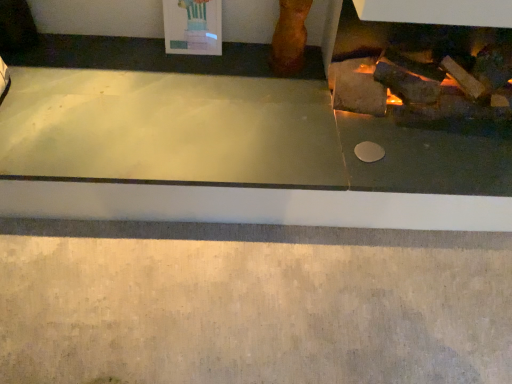
The width and height of the screenshot is (512, 384). Describe the element at coordinates (248, 144) in the screenshot. I see `matte stone fireplace at right` at that location.

What is the approximate width of matte stone fireplace at right?

matte stone fireplace at right is 33.99 inches in width.

Where is `matte stone fireplace at right`? This screenshot has height=384, width=512. matte stone fireplace at right is located at coordinates (248, 144).

This screenshot has width=512, height=384. Describe the element at coordinates (252, 304) in the screenshot. I see `smooth concrete at lower center` at that location.

Locate an element on the screen. The height and width of the screenshot is (384, 512). smooth concrete at lower center is located at coordinates (x=252, y=304).

Measure the distance between point (273, 245) and camera.

A distance of 1.52 meters exists between point (273, 245) and camera.

Locate an element on the screen. matte stone fireplace at right is located at coordinates (248, 144).

Based on the photo, can you confirm if matte stone fireplace at right is positioned to the left of smooth concrete at lower center?

Correct, you'll find matte stone fireplace at right to the left of smooth concrete at lower center.

Is matte stone fireplace at right in front of or behind smooth concrete at lower center in the image?

matte stone fireplace at right is positioned farther from the viewer than smooth concrete at lower center.

Is point (226, 151) positioned after point (231, 307)?

Yes, it is.

From the image's perspective, which is above, matte stone fireplace at right or smooth concrete at lower center?

From the image's view, matte stone fireplace at right is above.

Based on the photo, from a real-world perspective, between matte stone fireplace at right and smooth concrete at lower center, who is vertically lower?

In real-world perspective, smooth concrete at lower center is lower.

Does matte stone fireplace at right have a lesser width compared to smooth concrete at lower center?

Indeed, matte stone fireplace at right has a lesser width compared to smooth concrete at lower center.

Can you confirm if matte stone fireplace at right is shorter than smooth concrete at lower center?

Indeed, matte stone fireplace at right has a lesser height compared to smooth concrete at lower center.

Considering the relative sizes of matte stone fireplace at right and smooth concrete at lower center in the image provided, is matte stone fireplace at right smaller than smooth concrete at lower center?

Actually, matte stone fireplace at right might be larger than smooth concrete at lower center.

Do you think matte stone fireplace at right is within smooth concrete at lower center, or outside of it?

matte stone fireplace at right is outside smooth concrete at lower center.

Is matte stone fireplace at right placed right next to smooth concrete at lower center?

No, matte stone fireplace at right is not in contact with smooth concrete at lower center.

Is smooth concrete at lower center at the back of matte stone fireplace at right?

That's not correct — matte stone fireplace at right is not looking away from smooth concrete at lower center.

In the scene shown: What's the angular difference between matte stone fireplace at right and smooth concrete at lower center's facing directions?

matte stone fireplace at right and smooth concrete at lower center are facing 90.1 degrees away from each other.

Find the location of a particular element. The height and width of the screenshot is (384, 512). concrete in front of the matte stone fireplace at right is located at coordinates (252, 304).

Between smooth concrete at lower center and matte stone fireplace at right, which one appears on the left side from the viewer's perspective?

Positioned to the left is matte stone fireplace at right.

Considering the relative positions of smooth concrete at lower center and matte stone fireplace at right in the image provided, is smooth concrete at lower center behind matte stone fireplace at right?

No, the depth of smooth concrete at lower center is less than that of matte stone fireplace at right.

Considering the points (373, 376) and (479, 183), which point is behind, point (373, 376) or point (479, 183)?

Point (479, 183)

From the image's perspective, does smooth concrete at lower center appear lower than matte stone fireplace at right?

Correct, smooth concrete at lower center appears lower than matte stone fireplace at right in the image.

From a real-world perspective, which is physically above, smooth concrete at lower center or matte stone fireplace at right?

matte stone fireplace at right is physically above.

Looking at their sizes, would you say smooth concrete at lower center is wider or thinner than matte stone fireplace at right?

In the image, smooth concrete at lower center appears to be wider than matte stone fireplace at right.

Is smooth concrete at lower center taller than matte stone fireplace at right?

Yes, smooth concrete at lower center is taller than matte stone fireplace at right.

Which of these two, smooth concrete at lower center or matte stone fireplace at right, is smaller?

smooth concrete at lower center.

Is matte stone fireplace at right surrounded by smooth concrete at lower center?

No, matte stone fireplace at right is not a part of smooth concrete at lower center.

Is smooth concrete at lower center with matte stone fireplace at right?

No, smooth concrete at lower center is not making contact with matte stone fireplace at right.

Is matte stone fireplace at right at the back of smooth concrete at lower center?

smooth concrete at lower center is not turned away from matte stone fireplace at right.

I want to click on concrete located below the matte stone fireplace at right (from the image's perspective), so click(252, 304).

Identify the location of concrete in front of the matte stone fireplace at right. [252, 304].

Identify the location of fireplace located on the left of smooth concrete at lower center. This screenshot has width=512, height=384. (248, 144).